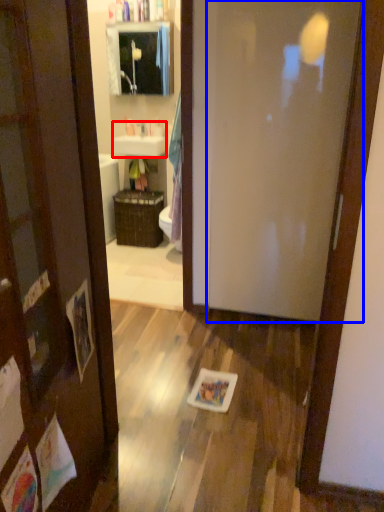
Question: Among these objects, which one is farthest to the camera, sink (highlighted by a red box) or door (highlighted by a blue box)?

Choices:
 (A) sink
 (B) door

Answer: (A)